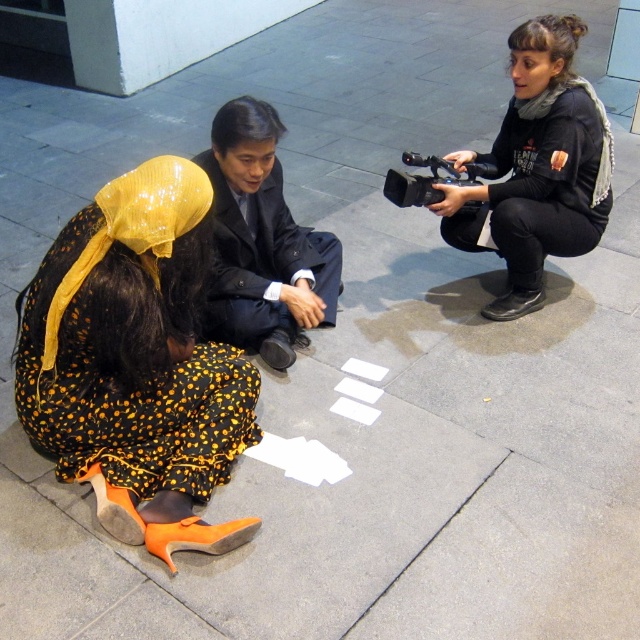
You are a photographer aiming to capture a candid shot of the orange fabric dress at lower left without including the black matte camera at center in the frame. Is this possible given their positions?

The orange fabric dress at lower left is below the black matte camera at center, so adjusting the camera angle downward might allow capturing the dress without the camera obstructing the view.